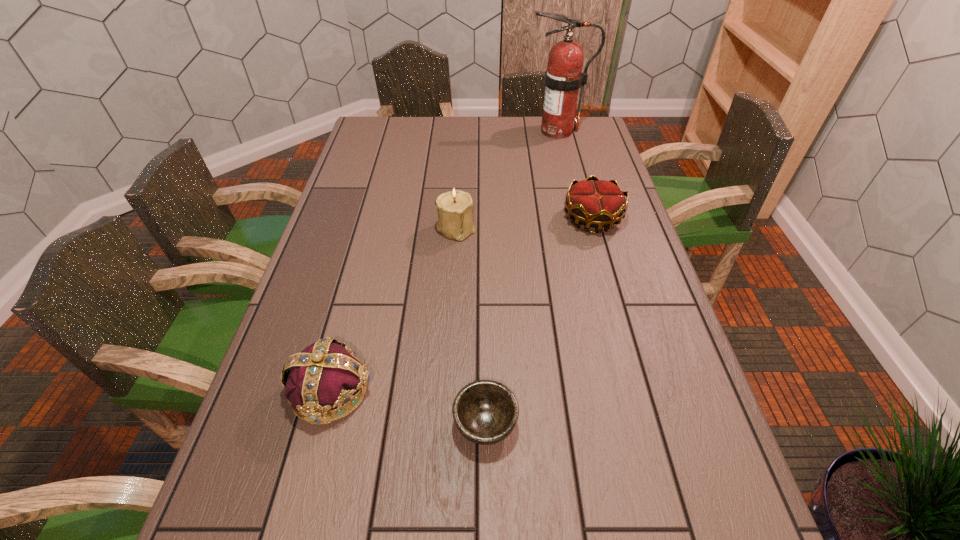
Identify the location of vacant space located 0.050m at the nozzle of the farthest object. (513, 131).

Image resolution: width=960 pixels, height=540 pixels. Identify the location of free location located on the left of the candle_holder. (339, 228).

Locate an element on the screen. blank space located 0.120m on the back of the left crown is located at coordinates (350, 314).

Identify the location of free location located 0.390m on the back of the second shortest object. (570, 139).

At what (x,y) coordinates should I click in order to perform the action: click on free space located 0.330m on the left of the shortest object. Please return your answer as a coordinate pair (x, y). The height and width of the screenshot is (540, 960). Looking at the image, I should click on (290, 423).

Where is `object at the far edge`? This screenshot has height=540, width=960. object at the far edge is located at coordinates (563, 78).

Identify the location of object positioned at the left edge. (327, 374).

Locate an element on the screen. The height and width of the screenshot is (540, 960). fire extinguisher at the right edge is located at coordinates (563, 78).

Locate an element on the screen. crown that is at the right edge is located at coordinates (597, 203).

The height and width of the screenshot is (540, 960). I want to click on object at the far right corner, so click(563, 78).